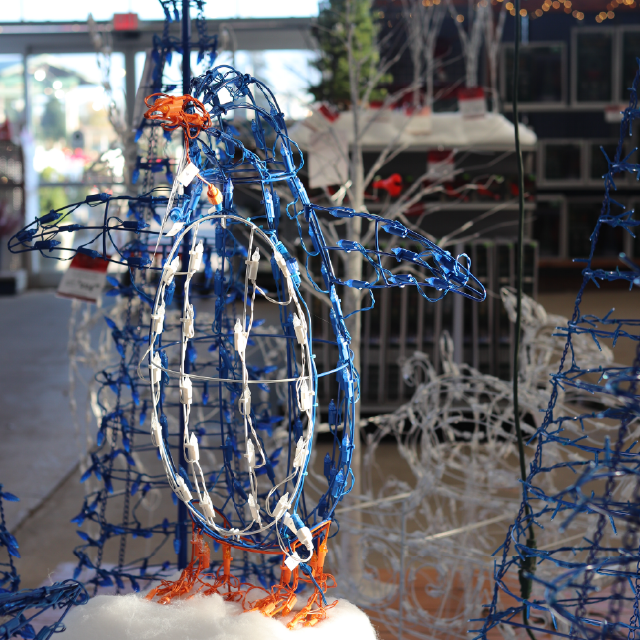
You are a GUI agent. You are given a task and a screenshot of the screen. Output one action in this format:
    pyautogui.click(x=<x>, y=<y>)
    Task: Click on the floor
    
    Given the screenshot: What is the action you would take?
    pyautogui.click(x=38, y=435)